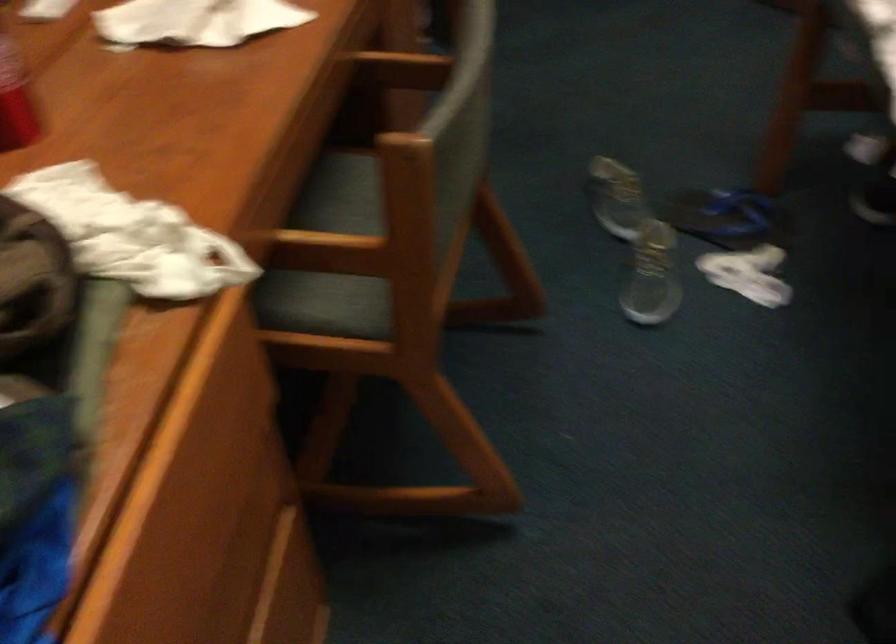
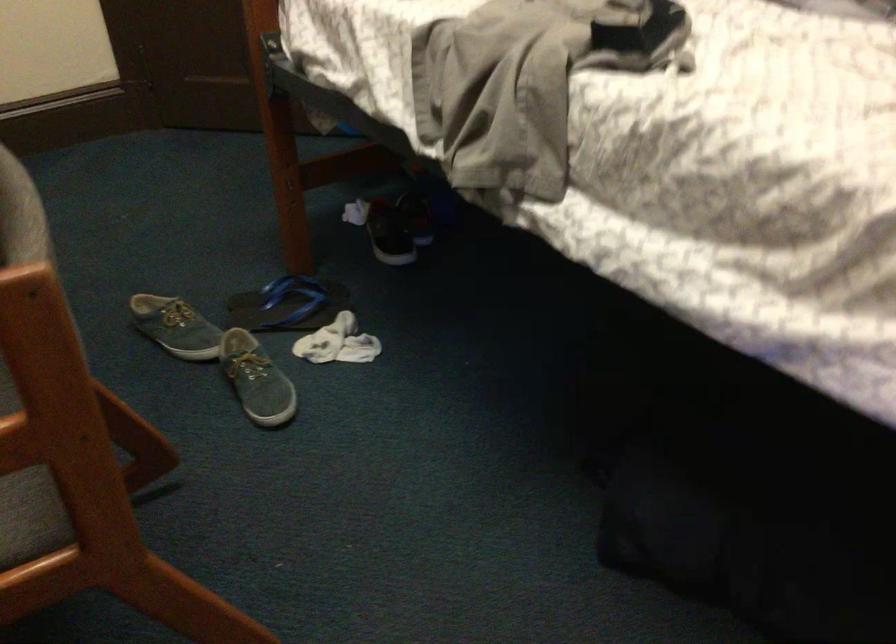
Question: The first image is from the beginning of the video and the second image is from the end. How did the camera likely rotate when shooting the video?

Choices:
 (A) Left
 (B) Right
 (C) Up
 (D) Down

Answer: (B)